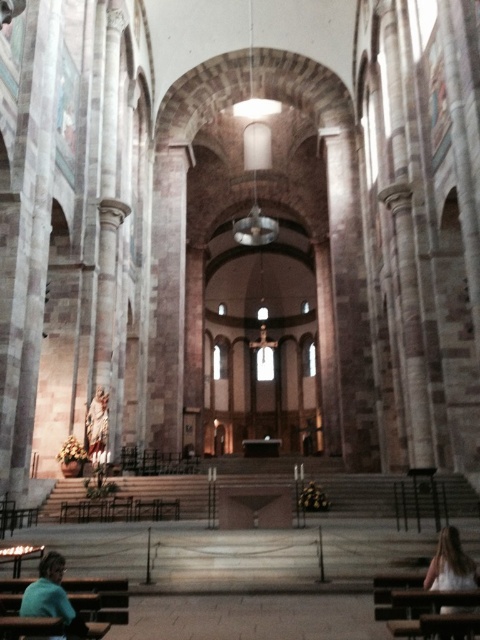
Is teal fabric shirt at lower left wider than matte stone statue at center?

Yes, teal fabric shirt at lower left is wider than matte stone statue at center.

Can you confirm if teal fabric shirt at lower left is thinner than matte stone statue at center?

In fact, teal fabric shirt at lower left might be wider than matte stone statue at center.

Who is more forward, (59, 595) or (101, 461)?

Positioned in front is point (59, 595).

The image size is (480, 640). In order to click on teal fabric shirt at lower left in this screenshot , I will do `click(51, 596)`.

Can you confirm if teal fabric shirt at lower left is taller than blonde hair at lower right?

In fact, teal fabric shirt at lower left may be shorter than blonde hair at lower right.

Is the position of teal fabric shirt at lower left less distant than that of blonde hair at lower right?

Yes, it is in front of blonde hair at lower right.

Which is behind, point (61, 556) or point (434, 588)?

Point (61, 556)

Find the location of a particular element. teal fabric shirt at lower left is located at coordinates (51, 596).

Which is behind, point (437, 570) or point (87, 422)?

Point (87, 422)

Which is more to the left, blonde hair at lower right or matte stone statue at center?

From the viewer's perspective, matte stone statue at center appears more on the left side.

Describe the element at coordinates (451, 564) in the screenshot. Image resolution: width=480 pixels, height=640 pixels. I see `blonde hair at lower right` at that location.

Identify the location of blonde hair at lower right. (451, 564).